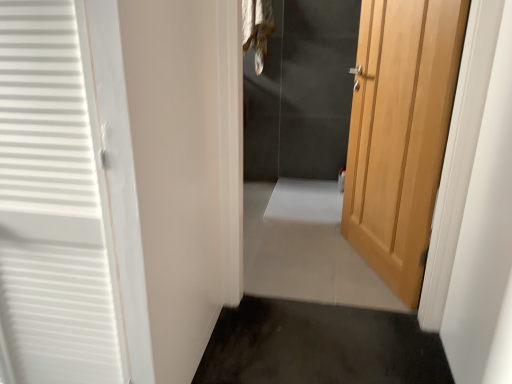
What are the coordinates of `vacant region below fur-like fabric at upper center (from a real-world perspective)` in the screenshot? It's located at (259, 182).